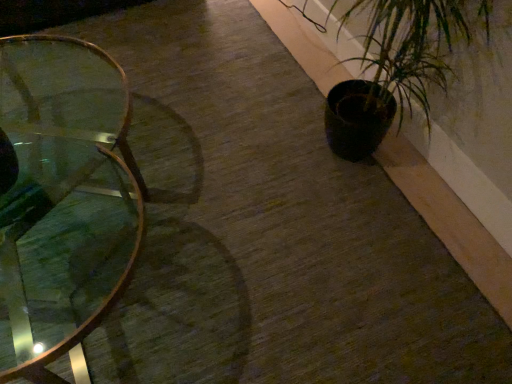
Question: Considering the positions of dark matte pot at right and clear glass table at left in the image, is dark matte pot at right bigger or smaller than clear glass table at left?

Choices:
 (A) big
 (B) small

Answer: (B)

Question: Considering the relative positions of dark matte pot at right and clear glass table at left in the image provided, is dark matte pot at right to the left or to the right of clear glass table at left?

Choices:
 (A) left
 (B) right

Answer: (B)

Question: From a real-world perspective, is dark matte pot at right above or below clear glass table at left?

Choices:
 (A) above
 (B) below

Answer: (A)

Question: Is clear glass table at left spatially inside dark matte pot at right, or outside of it?

Choices:
 (A) outside
 (B) inside

Answer: (A)

Question: In the image, is clear glass table at left positioned in front of or behind dark matte pot at right?

Choices:
 (A) front
 (B) behind

Answer: (A)

Question: Does point (8, 213) appear closer or farther from the camera than point (453, 31)?

Choices:
 (A) closer
 (B) farther

Answer: (A)

Question: Considering the positions of clear glass table at left and dark matte pot at right in the image, is clear glass table at left wider or thinner than dark matte pot at right?

Choices:
 (A) thin
 (B) wide

Answer: (B)